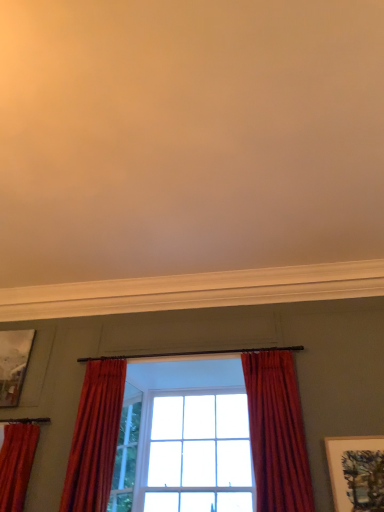
The width and height of the screenshot is (384, 512). Describe the element at coordinates (356, 472) in the screenshot. I see `matte white picture frame at lower right, acting as the second picture frame starting from the back` at that location.

This screenshot has height=512, width=384. I want to click on clear glass door at center, so click(x=126, y=452).

Is satin red curtain at center, positioned as the second curtain in right-to-left order, at the back of clear glass door at center?

No, satin red curtain at center, positioned as the second curtain in right-to-left order, is not at the back of clear glass door at center.

Are clear glass door at center and satin red curtain at center, positioned as the second curtain in right-to-left order, beside each other?

No, clear glass door at center is not touching satin red curtain at center, positioned as the second curtain in right-to-left order.

Who is shorter, clear glass door at center or satin red curtain at center, positioned as the second curtain in right-to-left order?

Standing shorter between the two is clear glass door at center.

Who is taller, metallic silver picture frame at upper left, acting as the second picture frame starting from the front, or matte white picture frame at lower right, which appears as the second picture frame when viewed from the left?

metallic silver picture frame at upper left, acting as the second picture frame starting from the front.

Does point (15, 400) lie behind point (337, 438)?

Yes, point (15, 400) is farther from viewer.

Is metallic silver picture frame at upper left, which is the 1th picture frame from back to front, to the left or to the right of matte white picture frame at lower right, the 1th picture frame in the front-to-back sequence, in the image?

metallic silver picture frame at upper left, which is the 1th picture frame from back to front, is positioned on matte white picture frame at lower right, the 1th picture frame in the front-to-back sequence,'s left side.

You are a GUI agent. You are given a task and a screenshot of the screen. Output one action in this format:
    pyautogui.click(x=<x>, y=<y>)
    Task: Click on the picture frame in front of the metallic silver picture frame at upper left, which is the 1th picture frame from back to front
    The height and width of the screenshot is (512, 384).
    Given the screenshot: What is the action you would take?
    pyautogui.click(x=356, y=472)

Is velvet red curtain at left, placed as the 3th curtain when sorted from right to left, not near satin red curtain at center, which is the second curtain from left to right?

No, velvet red curtain at left, placed as the 3th curtain when sorted from right to left, is not far away from satin red curtain at center, which is the second curtain from left to right.

What's the angular difference between velvet red curtain at left, placed as the 3th curtain when sorted from right to left, and satin red curtain at center, which is the second curtain from left to right,'s facing directions?

2.78 degrees.

Is velvet red curtain at left, placed as the 3th curtain when sorted from right to left, closer to camera compared to satin red curtain at center, which is the second curtain from left to right?

No.

Is velvet red curtain at left, the first curtain from the left, to the right of satin red curtain at center, which is the second curtain from left to right, from the viewer's perspective?

Incorrect, velvet red curtain at left, the first curtain from the left, is not on the right side of satin red curtain at center, which is the second curtain from left to right.

Who is smaller, clear glass door at center or metallic silver picture frame at upper left, acting as the second picture frame starting from the front?

With smaller size is clear glass door at center.

Is point (124, 418) farther from viewer compared to point (7, 341)?

No.

Would you consider clear glass door at center to be distant from metallic silver picture frame at upper left, acting as the second picture frame starting from the front?

clear glass door at center is far away from metallic silver picture frame at upper left, acting as the second picture frame starting from the front.

Which object is positioned more to the right, clear glass door at center or metallic silver picture frame at upper left, arranged as the 2th picture frame when ordered from the bottom?

From the viewer's perspective, clear glass door at center appears more on the right side.

Is metallic silver picture frame at upper left, arranged as the 2th picture frame when ordered from the bottom, not near satin red curtain at center, which is the second curtain from left to right?

No, metallic silver picture frame at upper left, arranged as the 2th picture frame when ordered from the bottom, is in close proximity to satin red curtain at center, which is the second curtain from left to right.

Is metallic silver picture frame at upper left, arranged as the 2th picture frame when ordered from the bottom, further to the viewer compared to satin red curtain at center, positioned as the second curtain in right-to-left order?

Yes, it is behind satin red curtain at center, positioned as the second curtain in right-to-left order.

Consider the image. Would you say metallic silver picture frame at upper left, arranged as the 2th picture frame when ordered from the bottom, is inside or outside satin red curtain at center, which is the second curtain from left to right?

metallic silver picture frame at upper left, arranged as the 2th picture frame when ordered from the bottom, is outside satin red curtain at center, which is the second curtain from left to right.

From a real-world perspective, between metallic silver picture frame at upper left, the 2th picture frame from the right, and satin red curtain at center, which is the second curtain from left to right, who is vertically lower?

satin red curtain at center, which is the second curtain from left to right, is physically lower.

From the image's perspective, is velvet red curtain at center, arranged as the third curtain when viewed from the left, above or below matte white picture frame at lower right, arranged as the 1th picture frame when ordered from the bottom?

Clearly, from the image's perspective, velvet red curtain at center, arranged as the third curtain when viewed from the left, is above matte white picture frame at lower right, arranged as the 1th picture frame when ordered from the bottom.

Which object is wider, velvet red curtain at center, which ranks as the 1th curtain in right-to-left order, or matte white picture frame at lower right, the 1th picture frame in the front-to-back sequence?

Wider between the two is velvet red curtain at center, which ranks as the 1th curtain in right-to-left order.

Is velvet red curtain at center, which ranks as the 1th curtain in right-to-left order, in contact with matte white picture frame at lower right, which is the 2th picture frame from top to bottom?

No, velvet red curtain at center, which ranks as the 1th curtain in right-to-left order, is not beside matte white picture frame at lower right, which is the 2th picture frame from top to bottom.

Between satin red curtain at center, which is the second curtain from left to right, and clear glass window at center, which one has larger width?

Wider between the two is clear glass window at center.

Locate an element on the screen. This screenshot has width=384, height=512. curtain that is the 1st one when counting leftward from the clear glass window at center is located at coordinates (95, 437).

Can you see satin red curtain at center, which is the second curtain from left to right, touching clear glass window at center?

No, satin red curtain at center, which is the second curtain from left to right, is not touching clear glass window at center.

Identify the location of curtain that is the 2nd one when counting upward from the clear glass door at center (from the image's perspective). This screenshot has height=512, width=384. click(95, 437).

Locate an element on the screen. This screenshot has height=512, width=384. picture frame below the metallic silver picture frame at upper left, the 1th picture frame positioned from the left (from the image's perspective) is located at coordinates (356, 472).

Estimate the real-world distances between objects in this image. Which object is further from clear glass door at center, velvet red curtain at center, arranged as the third curtain when viewed from the left, or metallic silver picture frame at upper left, the 1th picture frame positioned from the left?

velvet red curtain at center, arranged as the third curtain when viewed from the left.

Which object lies further to the anchor point velvet red curtain at center, which ranks as the 1th curtain in right-to-left order, metallic silver picture frame at upper left, the 2th picture frame from the right, or matte white picture frame at lower right, the 1th picture frame in the front-to-back sequence?

The object further to velvet red curtain at center, which ranks as the 1th curtain in right-to-left order, is metallic silver picture frame at upper left, the 2th picture frame from the right.

Considering their positions, is matte white picture frame at lower right, which appears as the second picture frame when viewed from the left, positioned closer to clear glass door at center than velvet red curtain at center, arranged as the third curtain when viewed from the left?

velvet red curtain at center, arranged as the third curtain when viewed from the left, lies closer to clear glass door at center than the other object.

When comparing their distances from clear glass door at center, does velvet red curtain at left, the first curtain from the left, or clear glass window at center seem further?

Based on the image, clear glass window at center appears to be further to clear glass door at center.

Which object lies further to the anchor point clear glass window at center, clear glass door at center or velvet red curtain at center, arranged as the third curtain when viewed from the left?

clear glass door at center.

From the image, which object appears to be nearer to velvet red curtain at left, the first curtain from the left, satin red curtain at center, positioned as the second curtain in right-to-left order, or clear glass window at center?

The object closer to velvet red curtain at left, the first curtain from the left, is satin red curtain at center, positioned as the second curtain in right-to-left order.

Considering their positions, is velvet red curtain at center, which ranks as the 1th curtain in right-to-left order, positioned closer to satin red curtain at center, positioned as the second curtain in right-to-left order, than clear glass window at center?

clear glass window at center.

In the scene shown: Estimate the real-world distances between objects in this image. Which object is closer to satin red curtain at center, positioned as the second curtain in right-to-left order, clear glass door at center or metallic silver picture frame at upper left, which is the 1th picture frame from back to front?

clear glass door at center is positioned closer to the anchor satin red curtain at center, positioned as the second curtain in right-to-left order.

This screenshot has width=384, height=512. In order to click on window between clear glass door at center and matte white picture frame at lower right, arranged as the 1th picture frame when ordered from the bottom, from left to right in this screenshot , I will do `click(277, 433)`.

Identify the location of window located between velvet red curtain at left, placed as the 3th curtain when sorted from right to left, and velvet red curtain at center, arranged as the third curtain when viewed from the left, in the left-right direction. The width and height of the screenshot is (384, 512). (277, 433).

Locate an element on the screen. The image size is (384, 512). window located between satin red curtain at center, which is the second curtain from left to right, and matte white picture frame at lower right, the 1th picture frame in the front-to-back sequence, in the left-right direction is located at coordinates (277, 433).

Image resolution: width=384 pixels, height=512 pixels. What are the coordinates of `glass door between velvet red curtain at left, placed as the 3th curtain when sorted from right to left, and matte white picture frame at lower right, the 1th picture frame in the front-to-back sequence, from left to right` in the screenshot? It's located at (126, 452).